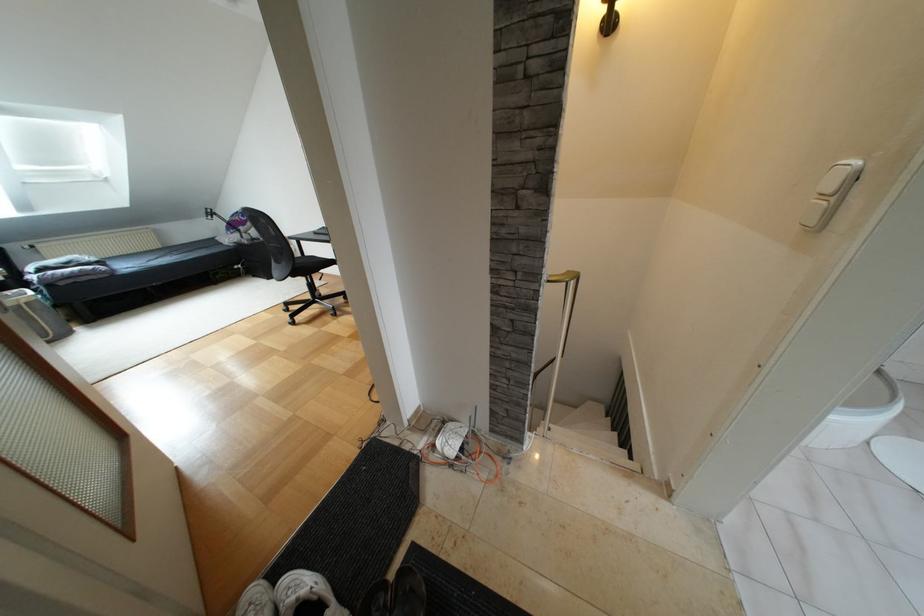
What do you see at coordinates (261, 223) in the screenshot?
I see `a black chair armrest` at bounding box center [261, 223].